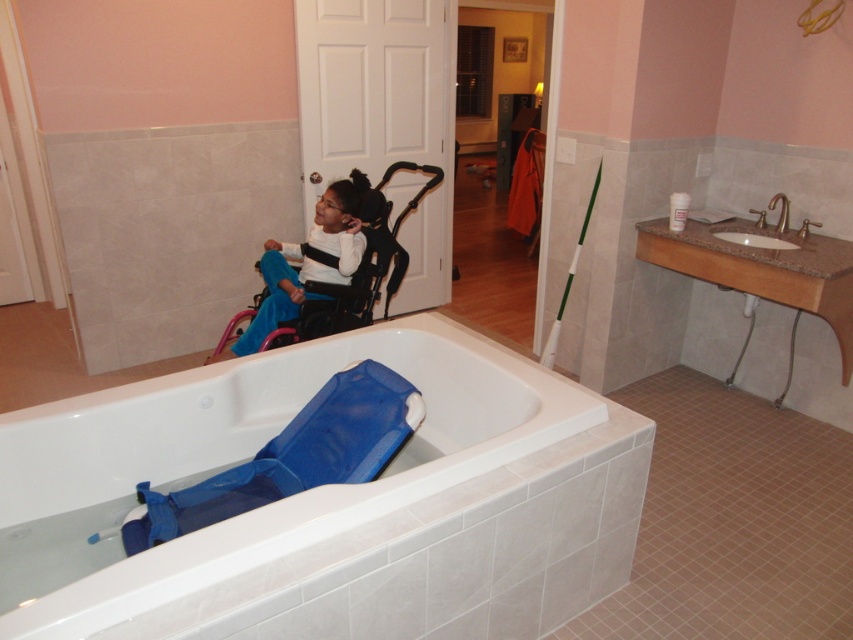
Is blue mesh baby carriage at lower left positioned behind matte black wheelchair at upper left?

That is False.

Find the location of a particular element. blue mesh baby carriage at lower left is located at coordinates (292, 456).

The width and height of the screenshot is (853, 640). I want to click on blue mesh baby carriage at lower left, so click(292, 456).

Is matte black wheelchair at upper left further to camera compared to white marble sink at upper right?

Yes, it is behind white marble sink at upper right.

Does matte black wheelchair at upper left appear on the left side of white marble sink at upper right?

Correct, you'll find matte black wheelchair at upper left to the left of white marble sink at upper right.

Where is `matte black wheelchair at upper left`? The width and height of the screenshot is (853, 640). matte black wheelchair at upper left is located at coordinates (308, 260).

This screenshot has width=853, height=640. In order to click on matte black wheelchair at upper left in this screenshot , I will do `click(308, 260)`.

What do you see at coordinates (254, 449) in the screenshot?
I see `white plastic bathtub at lower left` at bounding box center [254, 449].

Is white plastic bathtub at lower left below white marble sink at upper right?

Yes.

What do you see at coordinates (254, 449) in the screenshot?
I see `white plastic bathtub at lower left` at bounding box center [254, 449].

Locate an element on the screen. The width and height of the screenshot is (853, 640). white plastic bathtub at lower left is located at coordinates (254, 449).